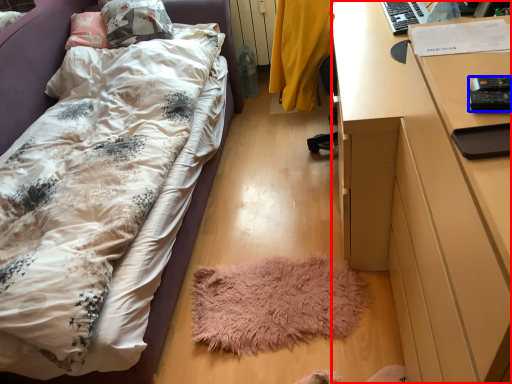
Question: Among these objects, which one is nearest to the camera, desk (highlighted by a red box) or remote control (highlighted by a blue box)?

Choices:
 (A) desk
 (B) remote control

Answer: (A)